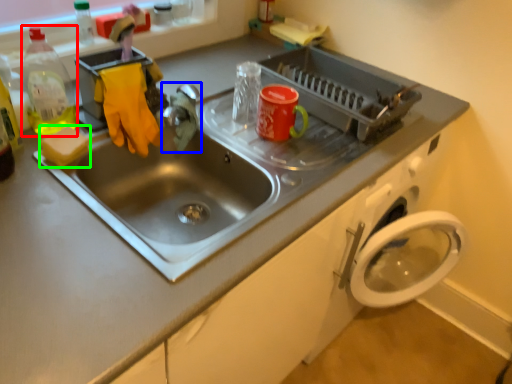
Question: Based on their relative distances, which object is nearer to bottle (highlighted by a red box)? Choose from faucet (highlighted by a blue box) and soap (highlighted by a green box).

Choices:
 (A) faucet
 (B) soap

Answer: (B)